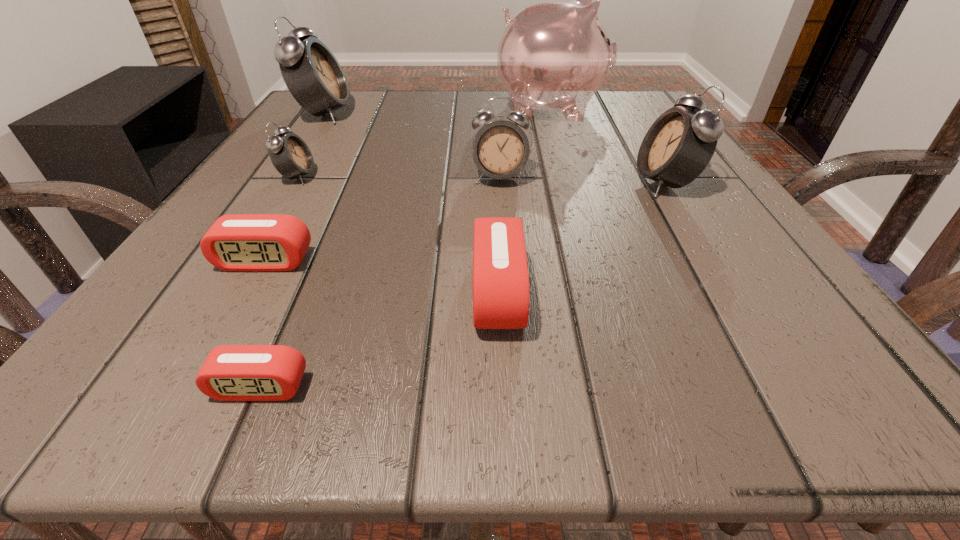
Locate an element on the screen. This screenshot has width=960, height=540. the biggest pink alarm clock is located at coordinates (501, 294).

Find the location of `the second biggest pink alarm clock`. the second biggest pink alarm clock is located at coordinates (241, 242).

Locate an element on the screen. This screenshot has width=960, height=540. the second shortest alarm clock is located at coordinates (241, 242).

Locate an element on the screen. The image size is (960, 540). the nearest pink alarm clock is located at coordinates (230, 372).

Locate an element on the screen. the nearest object is located at coordinates (230, 372).

Find the location of `vacant point located 0.100m on the front facing side of the piggy bank`. vacant point located 0.100m on the front facing side of the piggy bank is located at coordinates (653, 109).

I want to click on free location located 0.150m on the face of the biggest white alarm clock, so [x=423, y=114].

You are a GUI agent. You are given a task and a screenshot of the screen. Output one action in this format:
    pyautogui.click(x=<x>, y=<y>)
    Task: Click on the free region located on the face of the second biggest white alarm clock
    The width and height of the screenshot is (960, 540).
    Given the screenshot: What is the action you would take?
    click(x=487, y=183)

You are a GUI agent. You are given a task and a screenshot of the screen. Output one action in this format:
    pyautogui.click(x=<x>, y=<y>)
    Task: Click on the vacant space situated on the face of the second biggest white alarm clock
    Image resolution: width=960 pixels, height=540 pixels.
    Given the screenshot: What is the action you would take?
    pyautogui.click(x=456, y=183)

The width and height of the screenshot is (960, 540). What are the coordinates of `free space located on the face of the second biggest white alarm clock` in the screenshot? It's located at (587, 183).